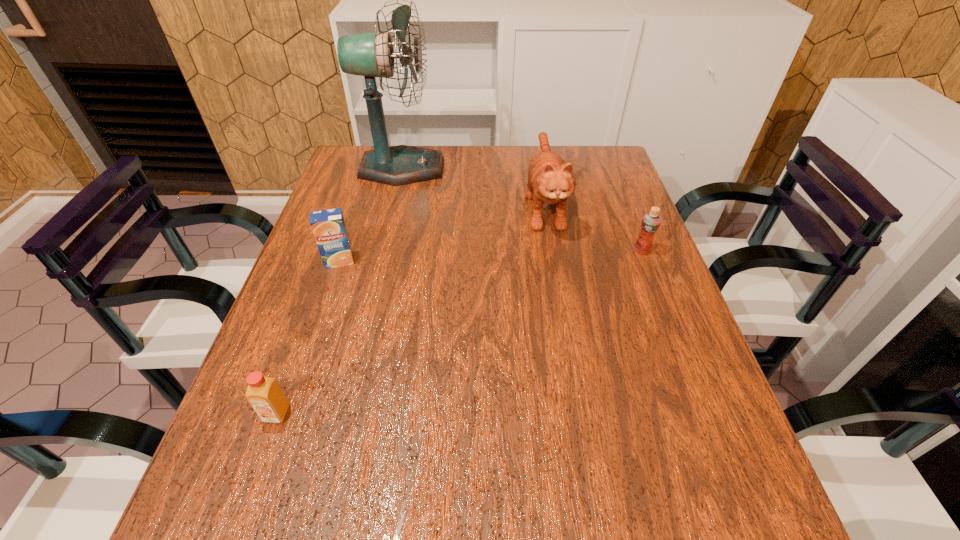
Locate an element on the screen. Image resolution: width=960 pixels, height=540 pixels. fan is located at coordinates (371, 54).

Where is `the fourth object from left to right`? This screenshot has width=960, height=540. the fourth object from left to right is located at coordinates (550, 180).

This screenshot has height=540, width=960. I want to click on cat, so click(x=550, y=180).

Locate an element on the screen. The height and width of the screenshot is (540, 960). the rightmost orange juice is located at coordinates (651, 221).

At what (x,y) coordinates should I click in order to perform the action: click on the nearest object. Please return your answer as a coordinate pair (x, y). The height and width of the screenshot is (540, 960). Looking at the image, I should click on [x=264, y=394].

Find the location of `vacant space situated in front of the tallest object where the wind blows`. vacant space situated in front of the tallest object where the wind blows is located at coordinates (547, 168).

Identify the location of vacant space located 0.100m on the face of the fourth object from left to right. This screenshot has width=960, height=540. (556, 271).

Image resolution: width=960 pixels, height=540 pixels. In order to click on vacant space located on the left of the rightmost object in this screenshot , I will do `click(555, 251)`.

At what (x,y) coordinates should I click in order to perform the action: click on free space located on the front and back of the nearest orange juice. Please return your answer as a coordinate pair (x, y). Looking at the image, I should click on (241, 515).

Find the location of a particular element. This screenshot has width=960, height=540. fan that is at the far edge is located at coordinates (371, 54).